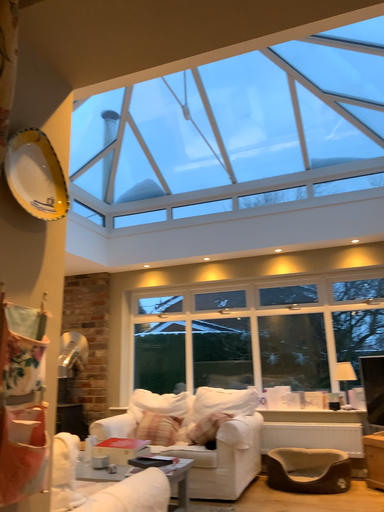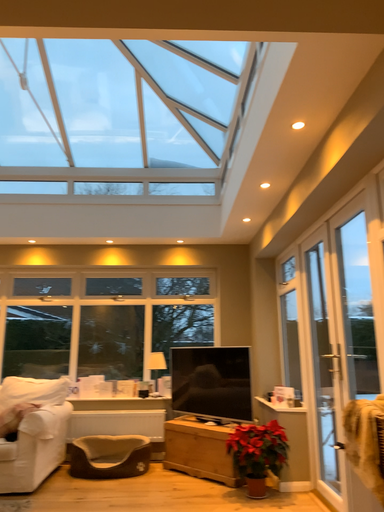
Question: Which way did the camera rotate in the video?

Choices:
 (A) rotated left
 (B) rotated right

Answer: (B)